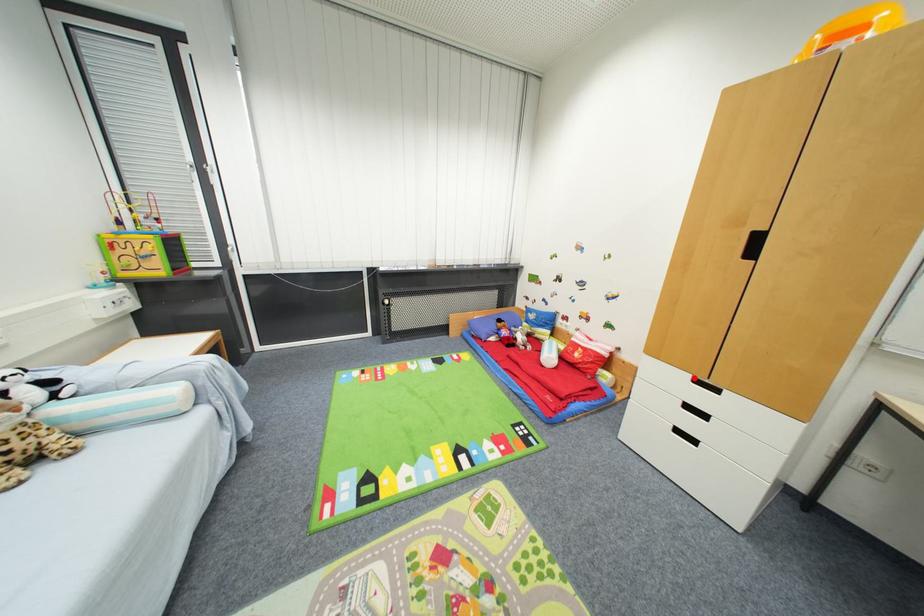
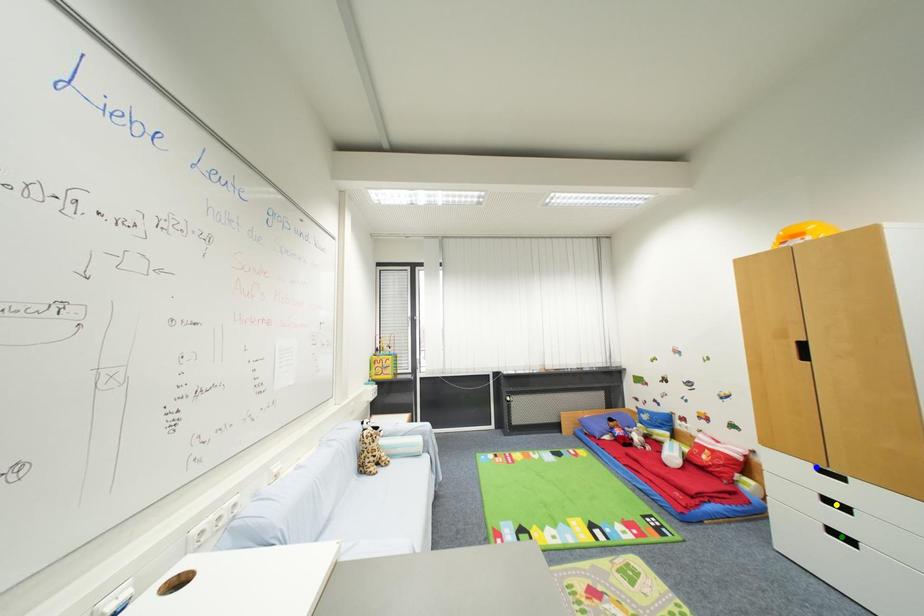
Question: I am providing you with two images of the same scene from different viewpoints. A red point is marked on the first image. You are given multiple points on the second image. In image 2, which mark is for the same physical point as the one in image 1?

Choices:
 (A) green point
 (B) blue point
 (C) yellow point

Answer: (B)